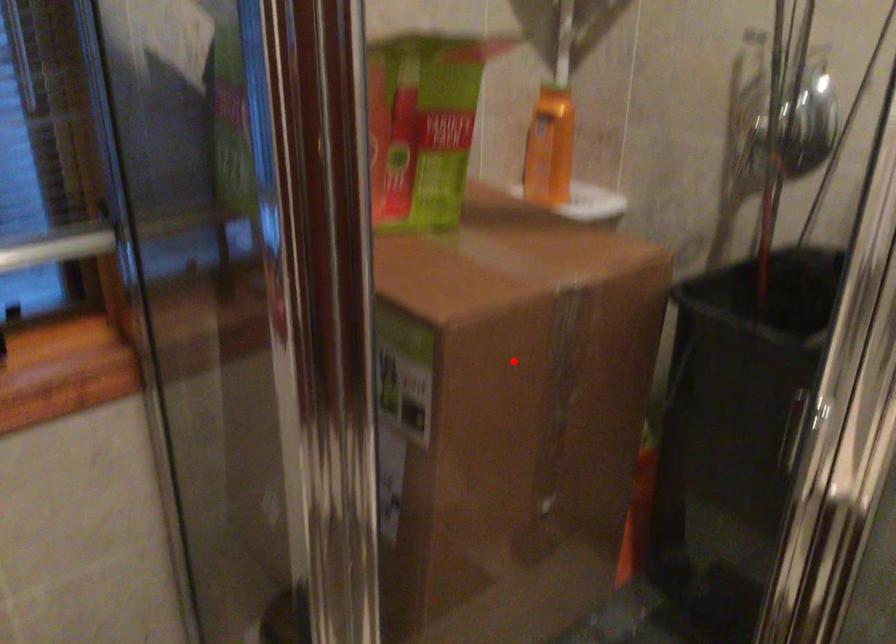
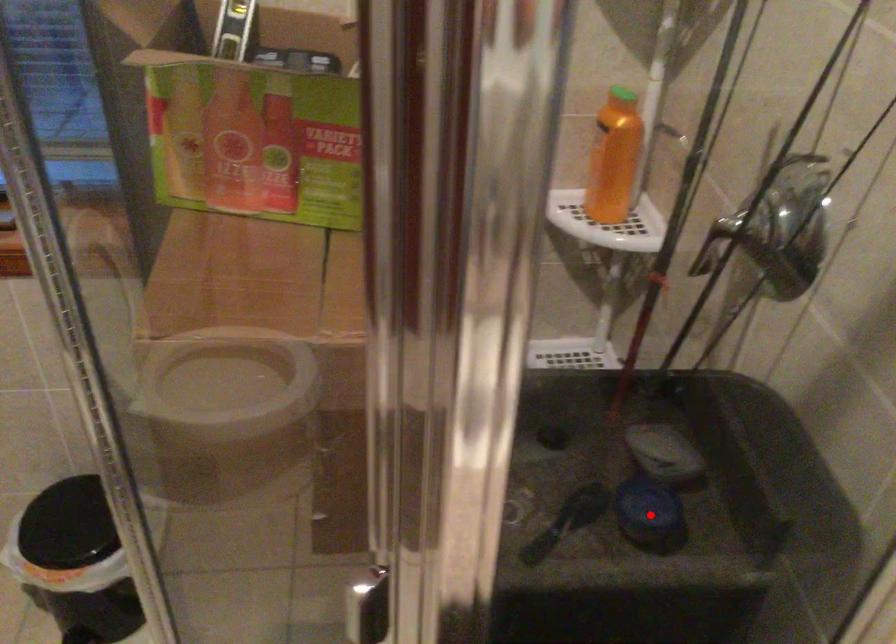
I am providing you with two images of the same scene from different viewpoints. A red point is marked on the first image and another point is marked on the second image. Are the points marked in image1 and image2 representing the same 3D position?

No